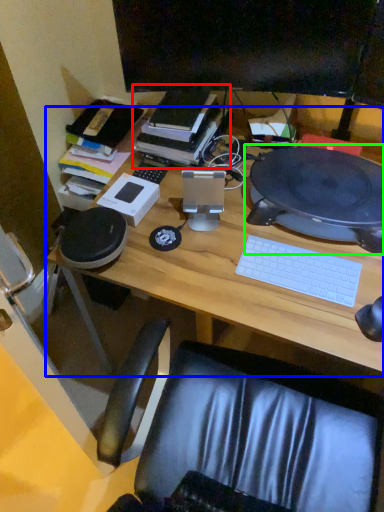
Question: Which is nearer to the book (highlighted by a red box)? desk (highlighted by a blue box) or computer (highlighted by a green box).

Choices:
 (A) desk
 (B) computer

Answer: (A)